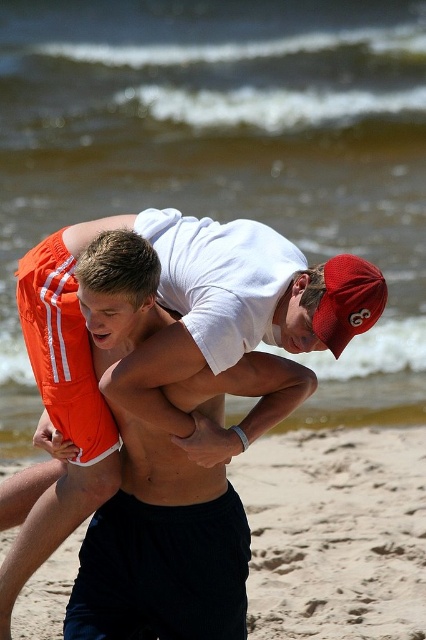
Is point (284, 627) positioned after point (363, 280)?

Yes.

Describe the element at coordinates (336, 532) in the screenshot. I see `sandy beach at lower center` at that location.

Is point (328, 490) behind point (359, 296)?

That is True.

This screenshot has width=426, height=640. In order to click on sandy beach at lower center in this screenshot , I will do `click(336, 532)`.

Is orange fabric life jacket at left shorter than red mesh baseball cap at upper right?

In fact, orange fabric life jacket at left may be taller than red mesh baseball cap at upper right.

Does orange fabric life jacket at left have a smaller size compared to red mesh baseball cap at upper right?

No.

Is point (69, 320) behind point (365, 292)?

Yes.

Identify the location of orange fabric life jacket at left. (63, 349).

Between orange fabric shorts at center and orange fabric life jacket at left, which one is positioned higher?

orange fabric shorts at center is above.

From the picture: Is orange fabric shorts at center shorter than orange fabric life jacket at left?

No, orange fabric shorts at center is not shorter than orange fabric life jacket at left.

Find the location of `orange fabric shorts at center`. orange fabric shorts at center is located at coordinates (232, 324).